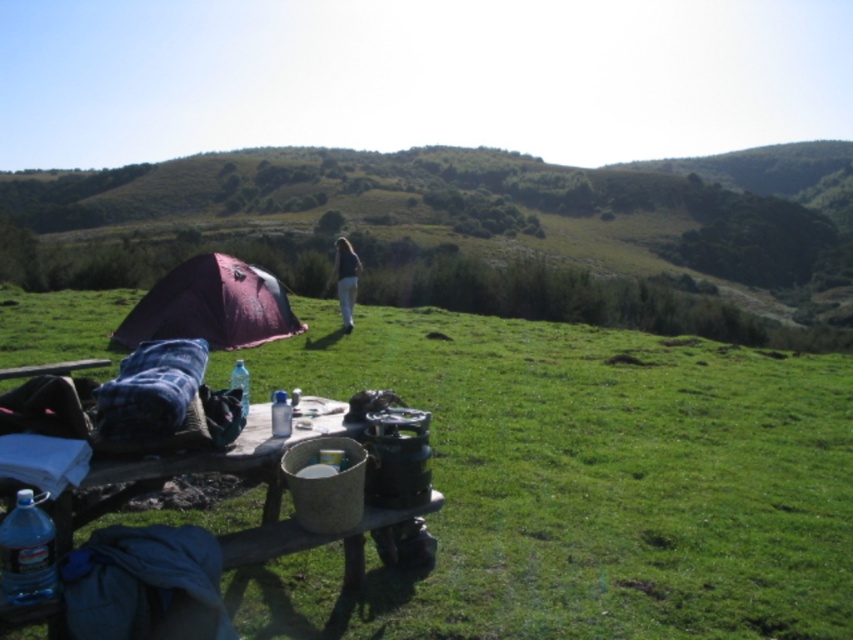
Does wooden picnic table at lower center have a lesser width compared to dark blue fabric at center?

Yes.

Measure the distance between wooden picnic table at lower center and dark blue fabric at center.

A distance of 11.97 meters exists between wooden picnic table at lower center and dark blue fabric at center.

Which is in front, point (125, 497) or point (358, 268)?

Point (125, 497) is in front.

Locate an element on the screen. wooden picnic table at lower center is located at coordinates (x=265, y=499).

Can you confirm if green grassy at center is bigger than purple fabric tent at upper left?

No.

Is point (819, 474) behind point (422, 188)?

No, it is not.

This screenshot has height=640, width=853. Identify the location of green grassy at center. (601, 477).

Which is in front, point (497, 163) or point (381, 556)?

Point (381, 556)

Who is lower down, purple fabric tent at upper left or wooden picnic table at lower center?

wooden picnic table at lower center

Between point (373, 268) and point (0, 620), which one is positioned in front?

Point (0, 620) is in front.

The height and width of the screenshot is (640, 853). In order to click on purple fabric tent at upper left in this screenshot , I will do click(x=474, y=232).